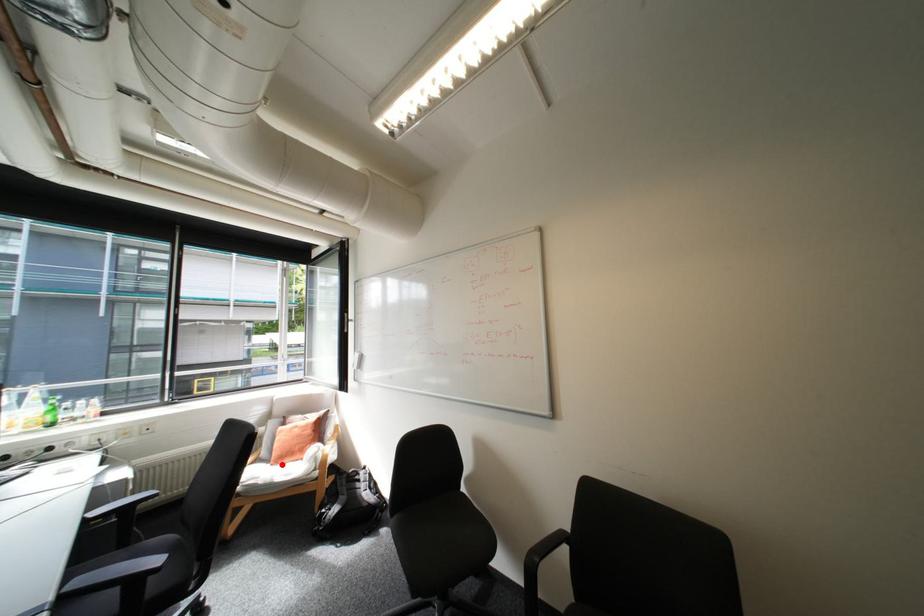
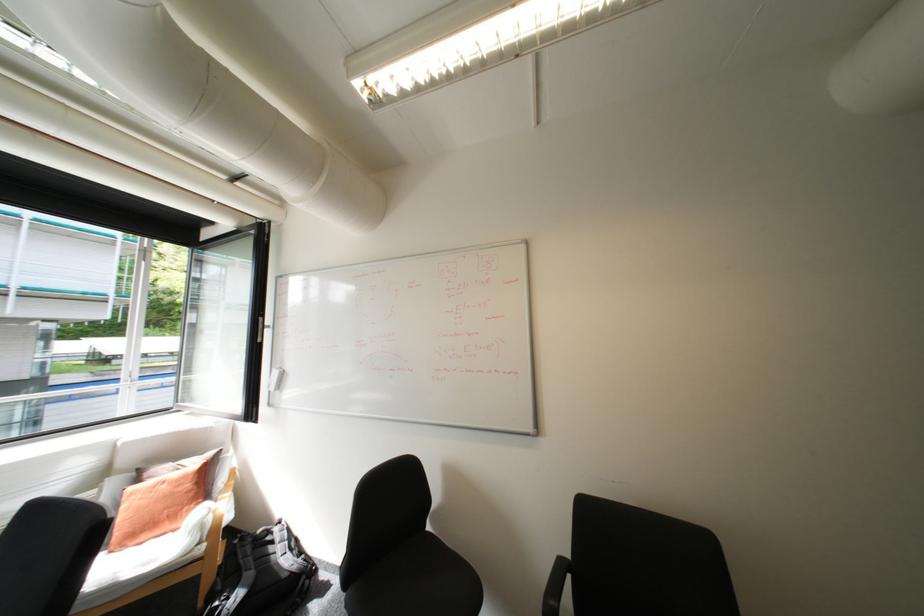
Question: I am providing you with two images of the same scene from different viewpoints. In image1, a red point is highlighted. Considering the same 3D point in image2, which of the following is correct?

Choices:
 (A) It is closer
 (B) It is farther

Answer: (B)